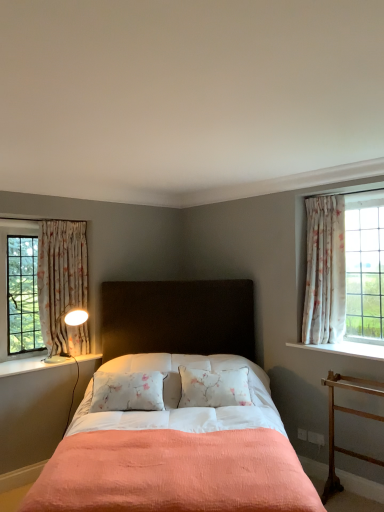
This screenshot has height=512, width=384. What are the coordinates of `free area below floral fabric curtain at right, marked as the first curtain in a right-to-left arrangement (from a real-world perspective)` in the screenshot? It's located at (330, 343).